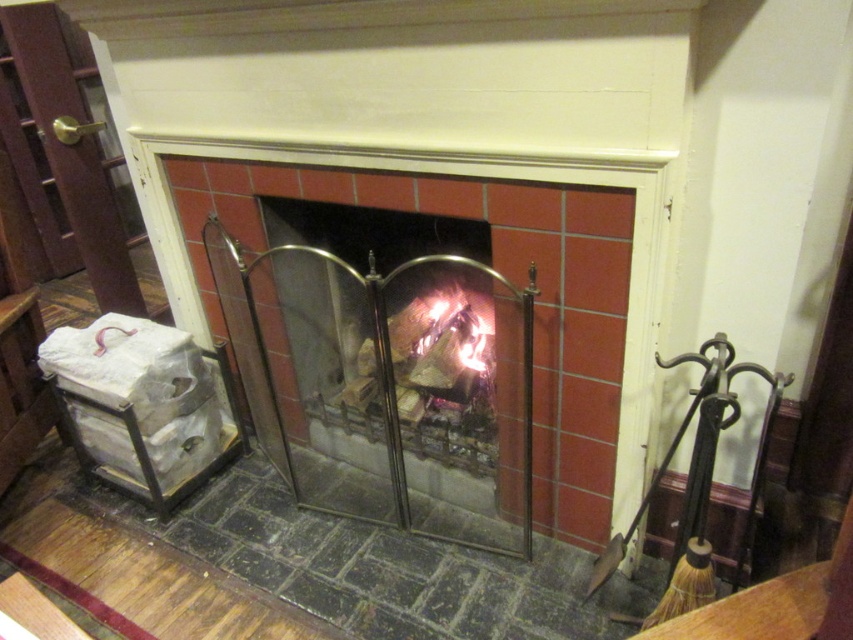
Can you confirm if matte metal fireplace screen at center is taller than charcoal wood fire at center?

Correct, matte metal fireplace screen at center is much taller as charcoal wood fire at center.

Looking at this image, is matte metal fireplace screen at center shorter than charcoal wood fire at center?

No, matte metal fireplace screen at center is not shorter than charcoal wood fire at center.

Is point (653, 307) positioned after point (421, 381)?

No, (653, 307) is in front of (421, 381).

In order to click on matte metal fireplace screen at center in this screenshot , I will do click(x=498, y=269).